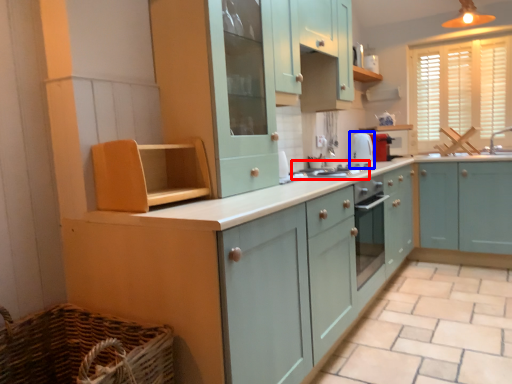
Question: Which of the following is the farthest to the observer, gas stove (highlighted by a red box) or appliance (highlighted by a blue box)?

Choices:
 (A) gas stove
 (B) appliance

Answer: (B)